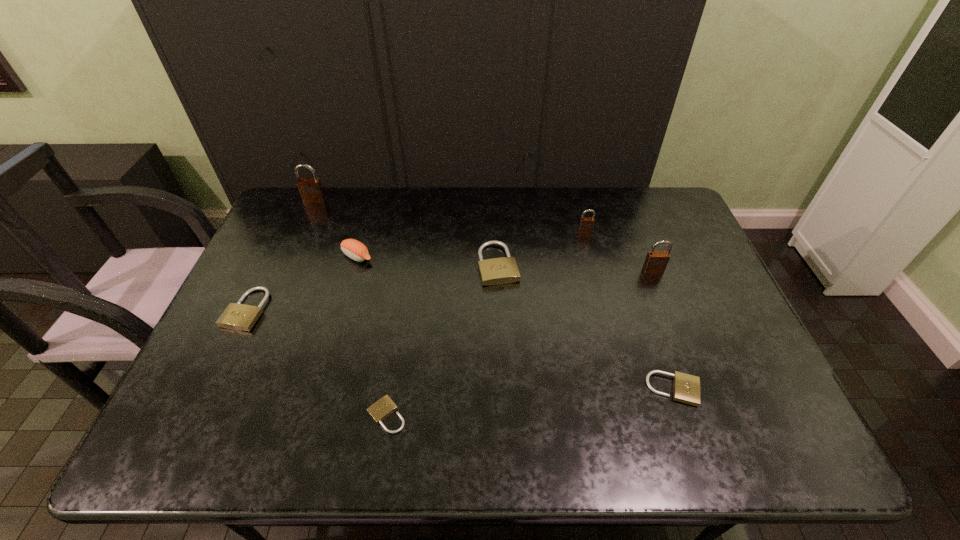
Locate an element on the screen. the farthest object is located at coordinates (311, 190).

Where is `the farthest brown padlock`? The image size is (960, 540). the farthest brown padlock is located at coordinates (311, 190).

Image resolution: width=960 pixels, height=540 pixels. Identify the location of the rightmost brown padlock. (656, 262).

Locate an element on the screen. The height and width of the screenshot is (540, 960). the second tallest object is located at coordinates (656, 262).

Locate an element on the screen. This screenshot has height=540, width=960. the sixth nearest padlock is located at coordinates (586, 224).

The width and height of the screenshot is (960, 540). In order to click on the smallest brown padlock in this screenshot , I will do `click(586, 224)`.

Where is `the fourth tallest object`? The width and height of the screenshot is (960, 540). the fourth tallest object is located at coordinates (354, 249).

Locate an element on the screen. This screenshot has width=960, height=540. the third object from left to right is located at coordinates (354, 249).

In order to click on the second beige padlock from right to left in this screenshot , I will do `click(504, 270)`.

You are a GUI agent. You are given a task and a screenshot of the screen. Output one action in this format:
    pyautogui.click(x=<x>, y=<y>)
    Task: Click on the fourth padlock from right to left
    
    Given the screenshot: What is the action you would take?
    pyautogui.click(x=504, y=270)